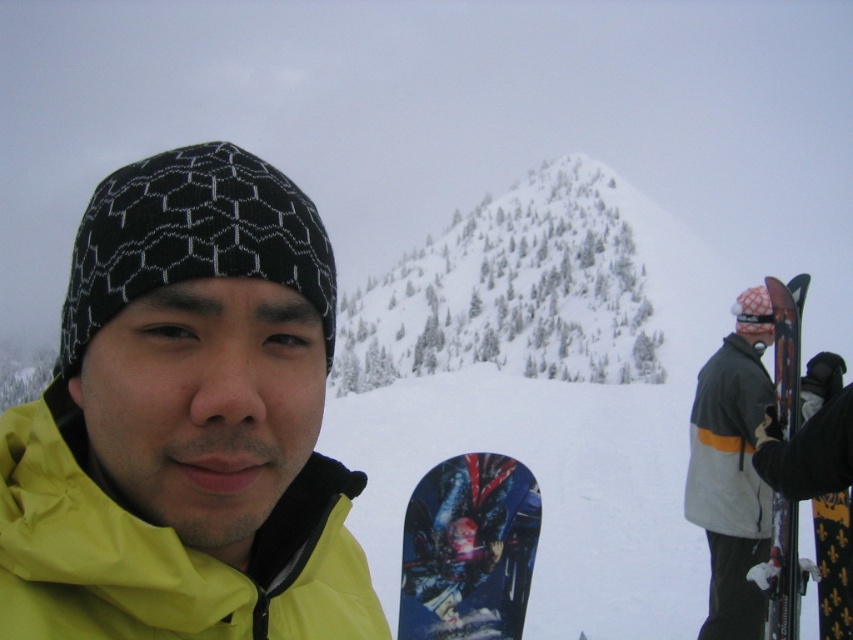
Looking at this image, you are a photographer trying to capture both the yellow matte jacket at lower left and the gray woolen jacket at right in a single shot. Based on their positions, which jacket is closer to the camera?

The yellow matte jacket at lower left is above the gray woolen jacket at right, meaning it is closer to the camera.

You are a photographer trying to capture a photo of both the gray woolen jacket at right and the gray fleece jacket at right. Since you can only focus on one jacket at a time, which jacket should you focus on to ensure the other remains in the background?

You should focus on the gray woolen jacket at right because it is above the gray fleece jacket at right, so the fleece jacket will naturally be in the background when the woolen jacket is in focus.